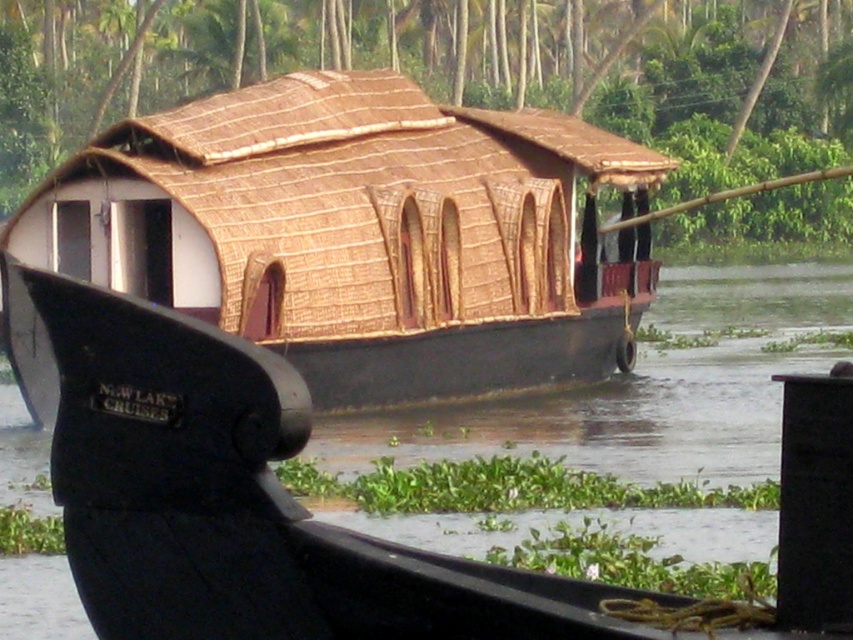
Question: In this image, where is brown thatched roof houseboat at center located relative to brown thatch roof at center?

Choices:
 (A) above
 (B) below

Answer: (B)

Question: Can you confirm if brown thatched roof houseboat at center is wider than brown thatch roof at center?

Choices:
 (A) no
 (B) yes

Answer: (A)

Question: Among these objects, which one is farthest from the camera?

Choices:
 (A) brown thatched roof houseboat at center
 (B) brown thatch roof at center

Answer: (B)

Question: Does brown thatched roof houseboat at center come in front of brown thatch roof at center?

Choices:
 (A) yes
 (B) no

Answer: (A)